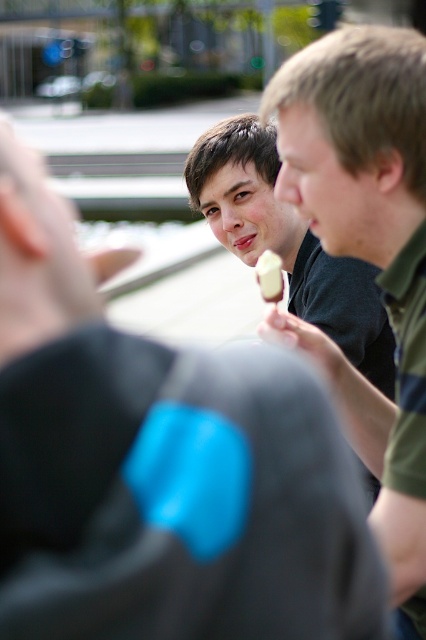
How distant is matte green shirt at center from matte plastic ice cream at center?

matte green shirt at center is 4.54 feet away from matte plastic ice cream at center.

Who is higher up, matte green shirt at center or matte plastic ice cream at center?

matte green shirt at center is higher up.

Is point (425, 572) closer to viewer compared to point (232, 140)?

Yes, point (425, 572) is in front of point (232, 140).

This screenshot has width=426, height=640. What are the coordinates of `matte green shirt at center` in the screenshot? It's located at (368, 256).

Which is above, matte green shirt at center or white creamy ice cream at center?

matte green shirt at center is above.

Which is behind, point (417, 72) or point (264, 300)?

The point (264, 300) is more distant.

Measure the distance between point (389,248) and camera.

Point (389,248) is 8.06 feet away from camera.

I want to click on matte green shirt at center, so click(368, 256).

Does matte plastic ice cream at center appear over white creamy ice cream at center?

Yes.

Based on the photo, can you confirm if matte plastic ice cream at center is wider than white creamy ice cream at center?

Correct, the width of matte plastic ice cream at center exceeds that of white creamy ice cream at center.

Find the location of a particular element. matte plastic ice cream at center is located at coordinates (287, 243).